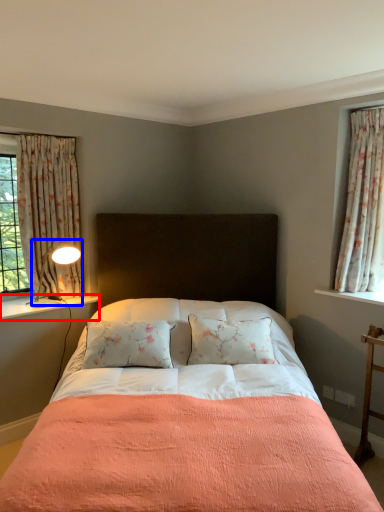
Question: Which point is further to the camera, window sill (highlighted by a red box) or light fixture (highlighted by a blue box)?

Choices:
 (A) window sill
 (B) light fixture

Answer: (B)